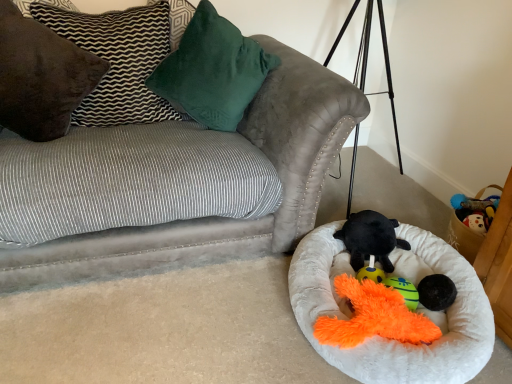
Question: From the image's perspective, does teal plush toy at lower center appear lower than velvety green pillow at upper center, acting as the 3th pillow starting from the left?

Choices:
 (A) no
 (B) yes

Answer: (B)

Question: Does teal plush toy at lower center have a lesser width compared to velvety green pillow at upper center, acting as the 3th pillow starting from the left?

Choices:
 (A) no
 (B) yes

Answer: (B)

Question: Is teal plush toy at lower center shorter than velvety green pillow at upper center, acting as the 3th pillow starting from the left?

Choices:
 (A) yes
 (B) no

Answer: (A)

Question: Are teal plush toy at lower center and velvety green pillow at upper center, acting as the 3th pillow starting from the left, beside each other?

Choices:
 (A) yes
 (B) no

Answer: (B)

Question: From a real-world perspective, is teal plush toy at lower center over velvety green pillow at upper center, acting as the 3th pillow starting from the left?

Choices:
 (A) no
 (B) yes

Answer: (A)

Question: Would you say velvety green pillow at upper center, which ranks as the 1th pillow in right-to-left order, is part of teal plush toy at lower center's contents?

Choices:
 (A) no
 (B) yes

Answer: (A)

Question: Is the position of teal plush toy at lower center more distant than that of brown suede pillow at upper left, which is counted as the second pillow, starting from the left?

Choices:
 (A) no
 (B) yes

Answer: (A)

Question: Can brown suede pillow at upper left, which is counted as the second pillow, starting from the left, be found inside teal plush toy at lower center?

Choices:
 (A) yes
 (B) no

Answer: (B)

Question: Can you confirm if teal plush toy at lower center is thinner than brown suede pillow at upper left, which is counted as the second pillow, starting from the left?

Choices:
 (A) no
 (B) yes

Answer: (B)

Question: Does teal plush toy at lower center have a smaller size compared to brown suede pillow at upper left, which is counted as the second pillow, starting from the left?

Choices:
 (A) yes
 (B) no

Answer: (A)

Question: Considering the relative sizes of teal plush toy at lower center and brown suede pillow at upper left, which appears as the second pillow when viewed from the right, in the image provided, is teal plush toy at lower center bigger than brown suede pillow at upper left, which appears as the second pillow when viewed from the right,?

Choices:
 (A) no
 (B) yes

Answer: (A)

Question: Can you confirm if teal plush toy at lower center is wider than brown suede pillow at upper left, which is counted as the second pillow, starting from the left?

Choices:
 (A) yes
 (B) no

Answer: (B)

Question: Is velvety green pillow at upper center, acting as the 3th pillow starting from the left, turned away from velvet gray couch at upper left?

Choices:
 (A) no
 (B) yes

Answer: (B)